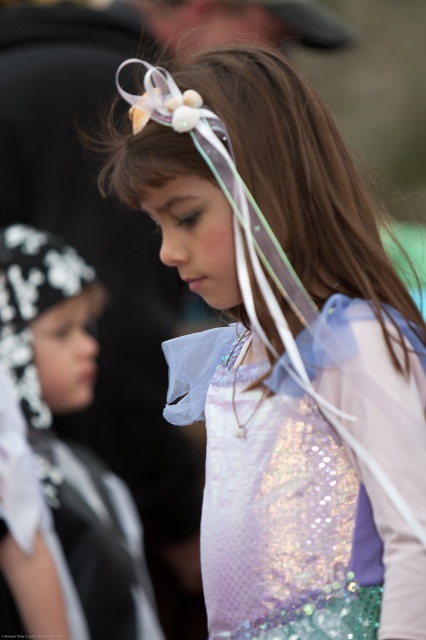
Is holographic sequin dress at center bigger than white sequined cape at left?

Incorrect, holographic sequin dress at center is not larger than white sequined cape at left.

Looking at this image, measure the distance from holographic sequin dress at center to white sequined cape at left.

They are 3.61 feet apart.

Is point (258, 612) positioned behind point (48, 300)?

No, it is in front of (48, 300).

This screenshot has width=426, height=640. Identify the location of holographic sequin dress at center. (287, 508).